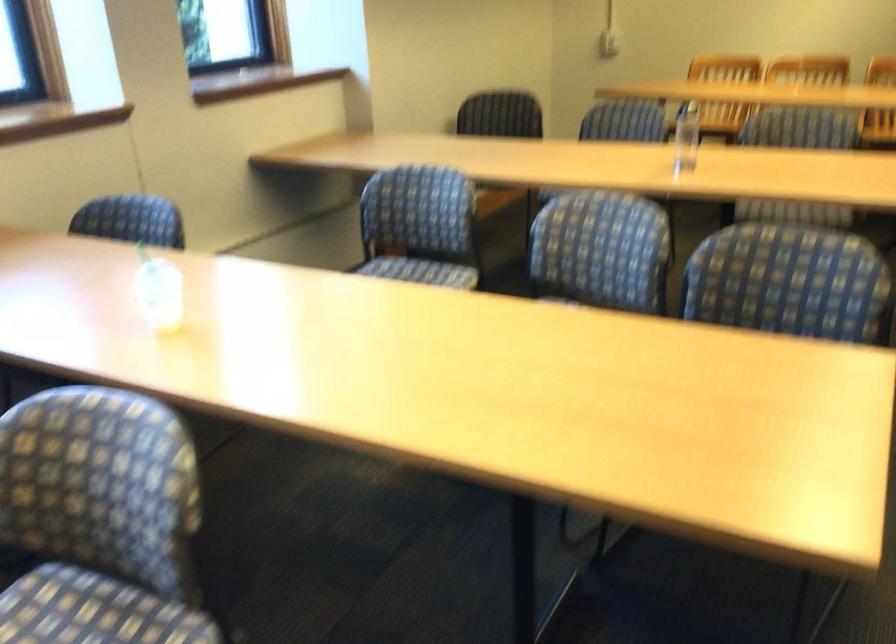
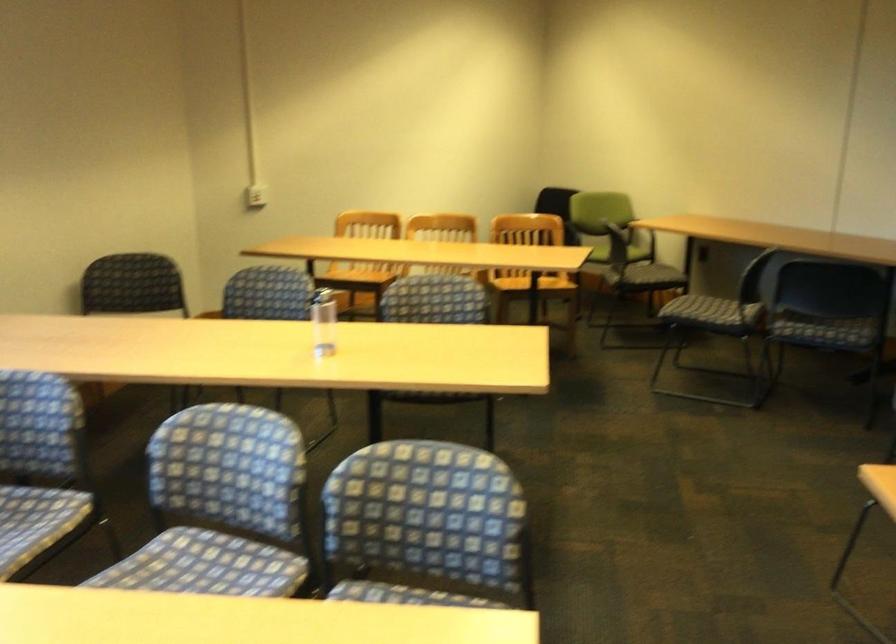
Find the pixel in the second image that matches the point at 590,279 in the first image.

(221, 506)